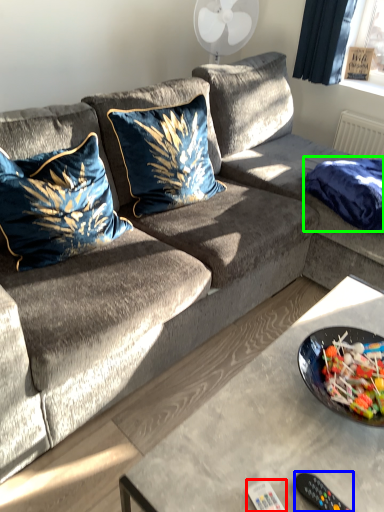
Question: Which is nearer to the remote (highlighted by a red box)? remote control (highlighted by a blue box) or blanket (highlighted by a green box).

Choices:
 (A) remote control
 (B) blanket

Answer: (A)